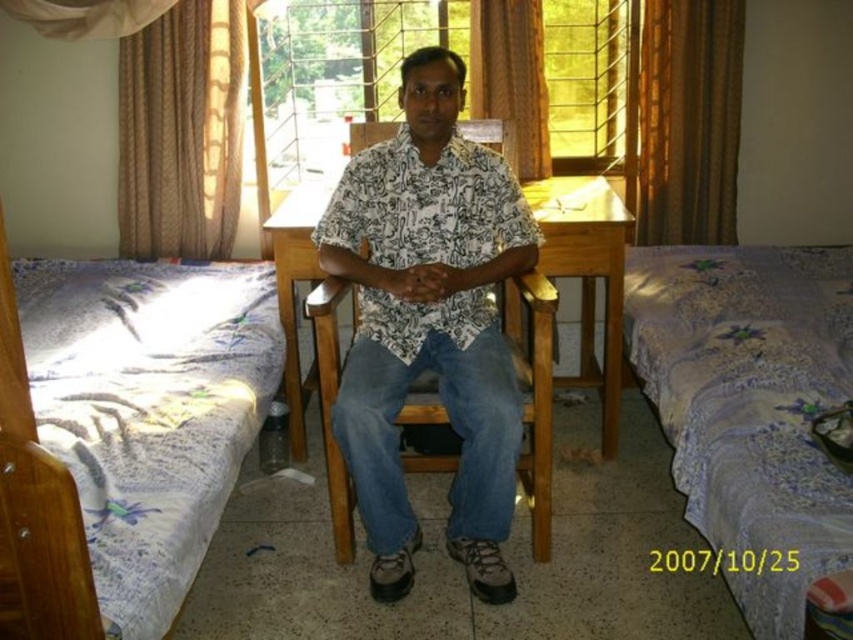
Question: Is white floral fabric bed at lower left above wooden table at center?

Choices:
 (A) no
 (B) yes

Answer: (A)

Question: Which object appears closest to the camera in this image?

Choices:
 (A) white printed shirt at center
 (B) wooden table at center
 (C) brown fabric curtain at upper center
 (D) brown fabric curtain at upper right

Answer: (A)

Question: Which object appears farthest from the camera in this image?

Choices:
 (A) linen bedspread at right
 (B) white floral fabric bed at lower left
 (C) brown fabric curtain at upper right

Answer: (C)

Question: Does white floral fabric bed at lower left come behind wooden table at center?

Choices:
 (A) no
 (B) yes

Answer: (A)

Question: Observing the image, what is the correct spatial positioning of white floral fabric bed at lower left in reference to brown fabric curtain at upper right?

Choices:
 (A) above
 (B) below

Answer: (B)

Question: Which of these objects is positioned farthest from the brown textured curtain at upper left?

Choices:
 (A) white floral fabric bed at lower left
 (B) wooden table at center

Answer: (B)